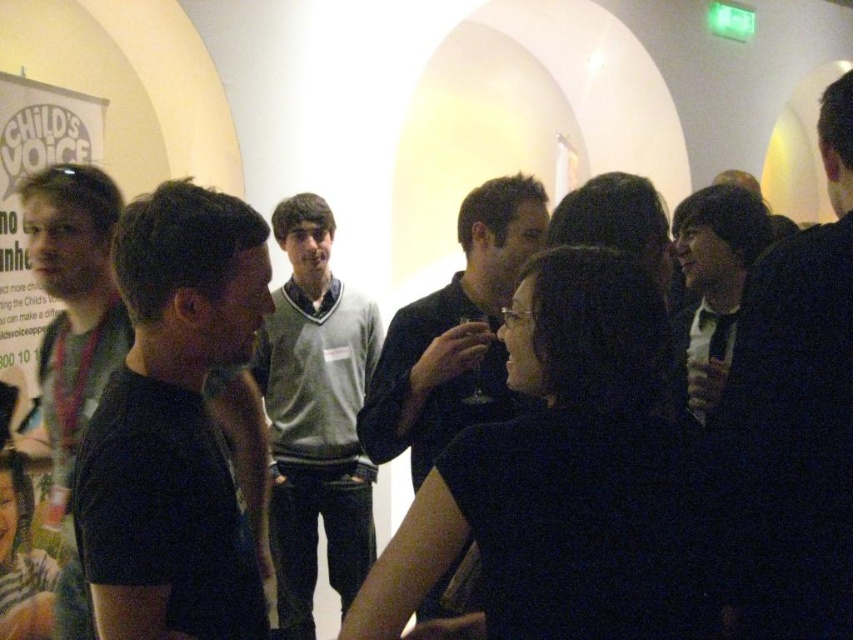
Which is more to the right, black matte shirt at left or black matte jacket at right?

black matte jacket at right is more to the right.

In order to click on black matte shirt at left in this screenshot , I will do `click(173, 426)`.

Between point (772, 465) and point (306, 550), which one is positioned behind?

Positioned behind is point (306, 550).

This screenshot has width=853, height=640. Describe the element at coordinates (798, 413) in the screenshot. I see `dark hair at center` at that location.

The width and height of the screenshot is (853, 640). What do you see at coordinates (798, 413) in the screenshot?
I see `dark hair at center` at bounding box center [798, 413].

Where is `dark hair at center`? This screenshot has width=853, height=640. dark hair at center is located at coordinates (798, 413).

Between dark hair at center and dark gray sweater at center, which one appears on the right side from the viewer's perspective?

dark hair at center is more to the right.

Is the position of dark hair at center more distant than that of dark gray sweater at center?

No, dark hair at center is in front of dark gray sweater at center.

Is point (816, 547) in front of point (433, 333)?

That is True.

The width and height of the screenshot is (853, 640). Identify the location of dark hair at center. (798, 413).